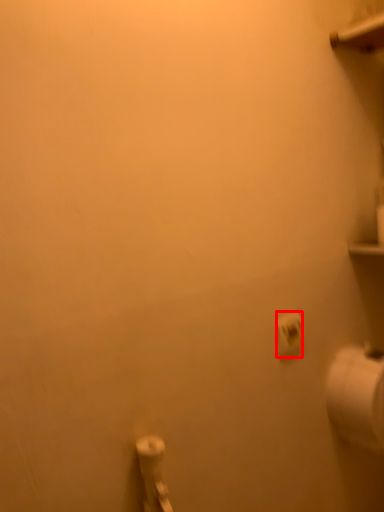
Question: Observing the image, what is the correct spatial positioning of toilet paper (annotated by the red box) in reference to toilet paper?

Choices:
 (A) right
 (B) left

Answer: (B)